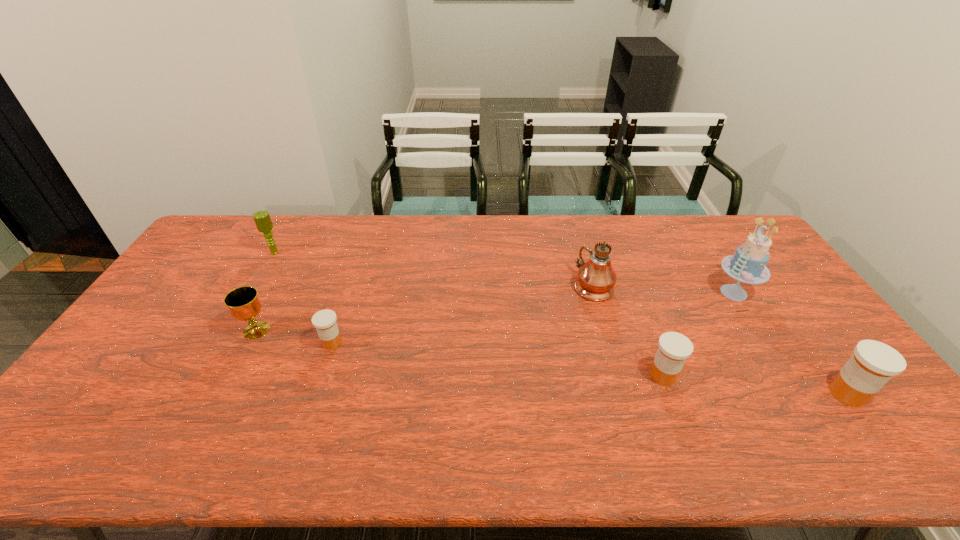
Locate which object ranks second in proximity to the chalice. Please provide its 2D coordinates. Your answer should be formatted as a tuple, i.e. [(x, y)], where the tuple contains the x and y coordinates of a point satisfying the conditions above.

[(262, 219)]

Where is `object that is the sixth closest to the shortest object`? Image resolution: width=960 pixels, height=540 pixels. object that is the sixth closest to the shortest object is located at coordinates (873, 364).

Find the location of a particular element. The width and height of the screenshot is (960, 540). medicine that is the second closest to the farthest medicine is located at coordinates (873, 364).

Identify which medicine is the second closest to the microphone. Please provide its 2D coordinates. Your answer should be formatted as a tuple, i.e. [(x, y)], where the tuple contains the x and y coordinates of a point satisfying the conditions above.

[(674, 348)]

At what (x,y) coordinates should I click in order to perform the action: click on free point that satisfies the following two spatial constraints: 1. with a ladder on the side of the cake; 2. on the label of the fifth object from left to right. Please return your answer as a coordinate pair (x, y). The height and width of the screenshot is (540, 960). Looking at the image, I should click on (786, 375).

Find the location of a particular element. free region that satisfies the following two spatial constraints: 1. with a ladder on the side of the second tallest object; 2. on the label of the third object from right to left is located at coordinates (786, 375).